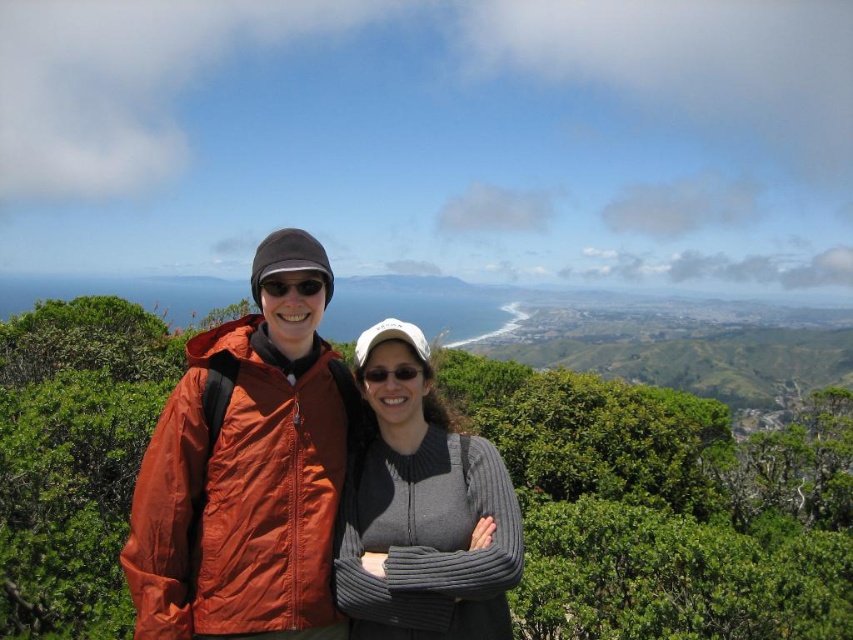
Measure the distance from gray ribbed sweater at center to sunglasses at center.

gray ribbed sweater at center is 1.22 meters from sunglasses at center.

Is gray ribbed sweater at center positioned before sunglasses at center?

Yes, gray ribbed sweater at center is in front of sunglasses at center.

Who is more distant from viewer, (373,596) or (403,378)?

The point (403,378) is behind.

You are a GUI agent. You are given a task and a screenshot of the screen. Output one action in this format:
    pyautogui.click(x=<x>, y=<y>)
    Task: Click on the gray ribbed sweater at center
    The height and width of the screenshot is (640, 853).
    Given the screenshot: What is the action you would take?
    pyautogui.click(x=422, y=513)

Can you confirm if matte orange jacket at center is bigger than sunglasses at center?

Yes, matte orange jacket at center is bigger than sunglasses at center.

Between point (397, 390) and point (379, 369), which one is positioned behind?

The point (379, 369) is behind.

Does point (300, 266) come closer to viewer compared to point (372, 372)?

Yes, point (300, 266) is closer to viewer.

Image resolution: width=853 pixels, height=640 pixels. Find the location of `matte orange jacket at center`. matte orange jacket at center is located at coordinates (402, 413).

Who is shorter, matte black sunglasses at center or sunglasses at center?

sunglasses at center

Does point (291, 284) come closer to viewer compared to point (408, 368)?

Yes, it is in front of point (408, 368).

Which is behind, point (305, 273) or point (364, 369)?

Positioned behind is point (364, 369).

At what (x,y) coordinates should I click in order to perform the action: click on matte black sunglasses at center. Please return your answer as a coordinate pair (x, y). Looking at the image, I should click on (293, 284).